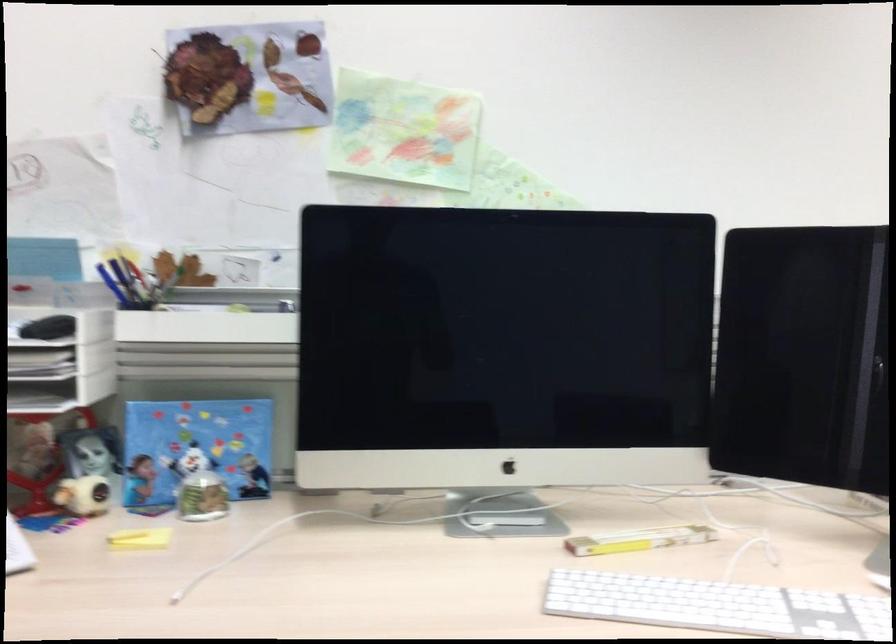
Image resolution: width=896 pixels, height=644 pixels. Identify the location of yellow sticky note. (140, 538).